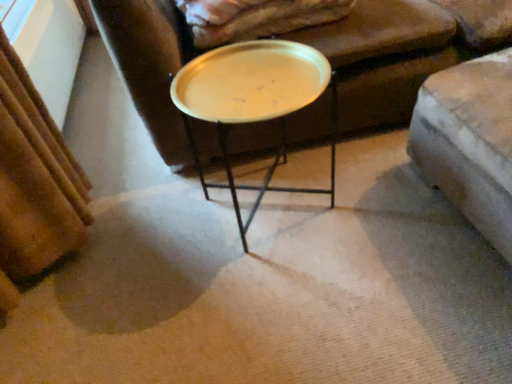
Image resolution: width=512 pixels, height=384 pixels. Find the location of `vacant area in front of metallic gold tray at center`. vacant area in front of metallic gold tray at center is located at coordinates (285, 300).